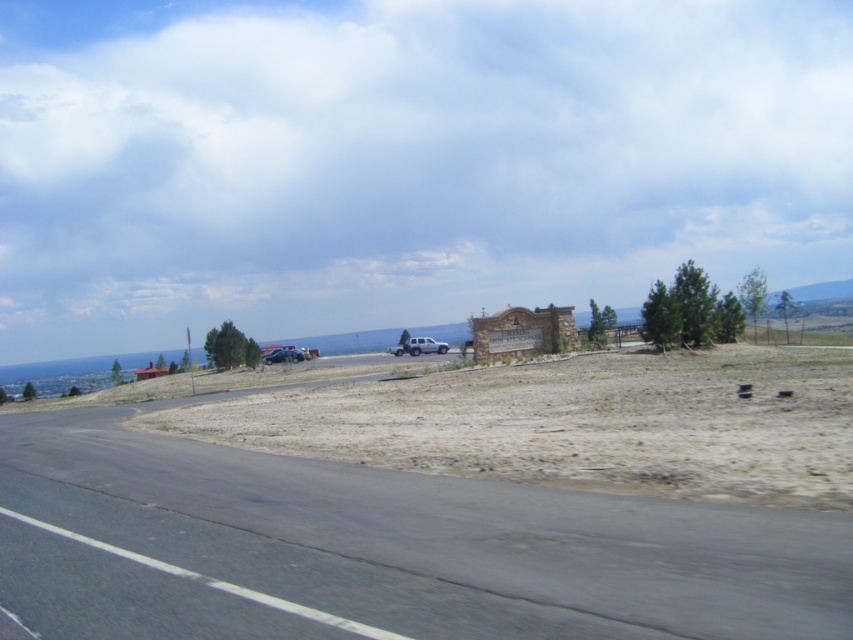
You are driving a car and see the asphalt road at lower left and the silver metallic truck at center. Which object is closer to you?

The asphalt road at lower left is positioned under the silver metallic truck at center, meaning the truck is closer to you than the road.

You are driving a delivery van that is 6 meters long. You come across the image and need to pass through the road at center. Are both the silver metallic truck at center and the metallic blue truck at center blocking your path? Please explain based on their sizes.

The silver metallic truck at center is larger in size than the metallic blue truck at center. Since the delivery van is 6 meters long, it depends on the trucks actual dimensions. However, without knowing their exact lengths, it is impossible to determine if they block the path. Please provide more information about the trucks dimensions.

From the picture: You are driving a car that is 1.8 meters wide and want to pass through the area between the silver metallic truck at center and the metallic blue truck at center. Based on the scene, can your car fit through the space between them?

The silver metallic truck at center is wider than the metallic blue truck at center. However, without specific information about the distance between them, it is impossible to determine if your car can fit through the space.